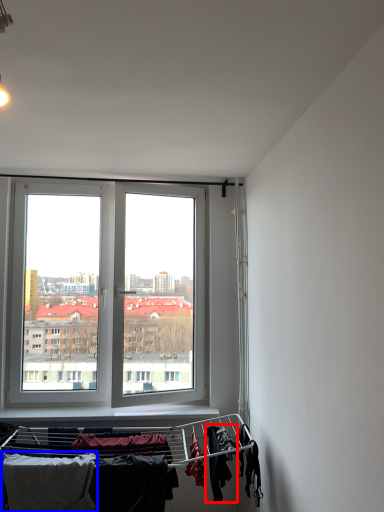
Question: Among these objects, which one is farthest to the camera, clothing (highlighted by a red box) or clothing (highlighted by a blue box)?

Choices:
 (A) clothing
 (B) clothing

Answer: (A)